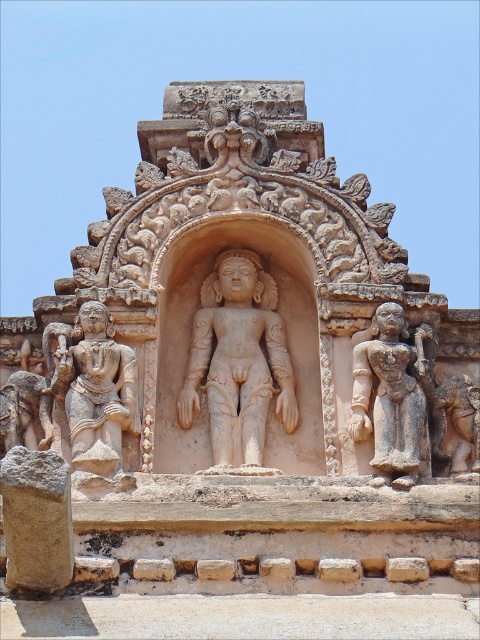
You are standing in front of an ancient stone structure and want to take a photo of the beige stone statue at center. If your camera can focus on objects within 80 meters, will it be able to capture the statue clearly?

The beige stone statue at center is 77.48 meters away from the camera, which is within the 80 meters focus range. Therefore, the camera should be able to capture the statue clearly.

You are an archaeologist examining the ancient stone structure. You notice the beige stone statue at center and the stone statue at left. Which statue is larger in size?

The beige stone statue at center is bigger than the stone statue at left according to the description provided.